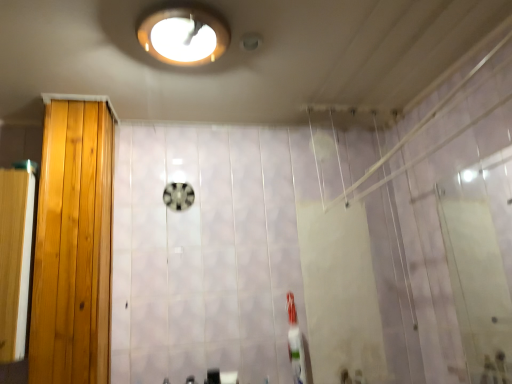
Question: In the image, is wooden screen door at left, which ranks as the second screen door in right-to-left order, positioned in front of or behind light brown wood door at left?

Choices:
 (A) behind
 (B) front

Answer: (B)

Question: From the image's perspective, is wooden screen door at left, arranged as the first screen door when viewed from the left, located above or below light brown wood door at left?

Choices:
 (A) below
 (B) above

Answer: (A)

Question: Which is nearer to the transparent glass screen door at right, the 1th screen door from the right?

Choices:
 (A) light brown wood door at left
 (B) matte white light fixture at upper center
 (C) wooden screen door at left, arranged as the first screen door when viewed from the left

Answer: (B)

Question: Which object is the closest to the transparent glass screen door at right, the second screen door viewed from the left?

Choices:
 (A) light brown wood door at left
 (B) matte white light fixture at upper center
 (C) wooden screen door at left, arranged as the first screen door when viewed from the left

Answer: (B)